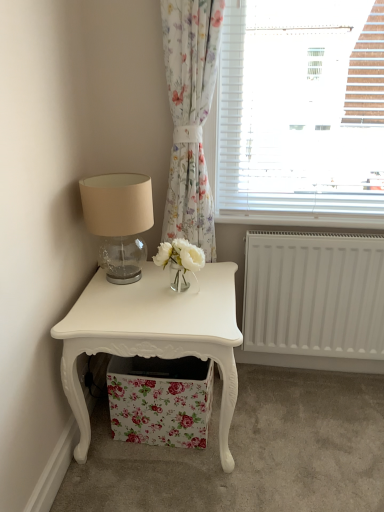
Identify the location of unoccupied region to the right of white glossy nightstand at lower left. The height and width of the screenshot is (512, 384). (310, 444).